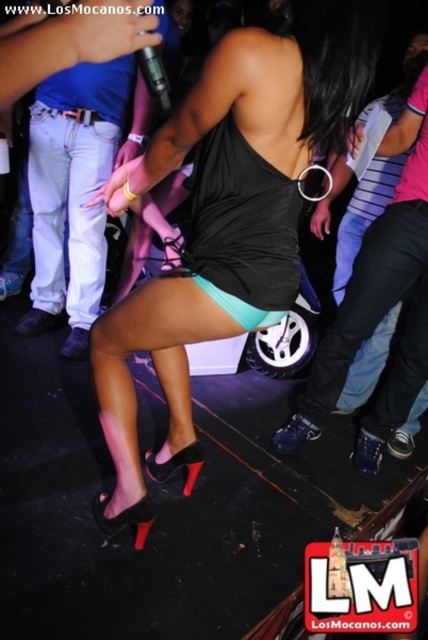
You are at a party and want to take a photo of the matte black dress at center and the jeans at left. Which one should you focus on if you want the one on the left side of the frame to be clear?

The jeans at left should be focused on since the matte black dress at center is positioned on the right side of jeans at left, making the jeans at left the one on the left side of the frame.

Looking at this image, you are a photographer at the nightclub trying to capture a photo of the performer. You notice the matte black dress at center and the black leather pants at lower right. Which object should you focus on if you want to photograph the taller one?

The matte black dress at center is taller than the black leather pants at lower right, so you should focus on the matte black dress at center.